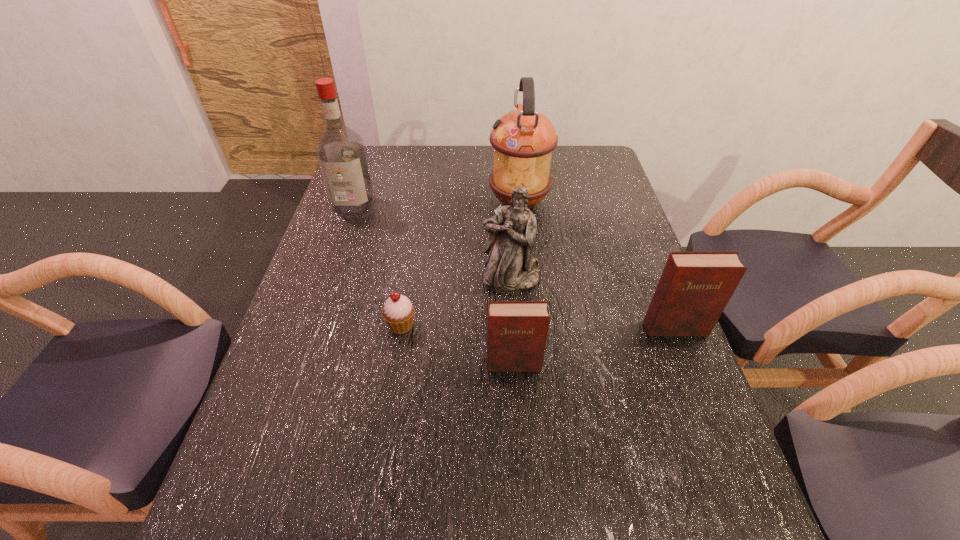
In order to click on free space between the shorter diary and the right diary in this screenshot , I will do `click(594, 346)`.

Where is `vacant point located between the liquor and the fifth object from right to left`? vacant point located between the liquor and the fifth object from right to left is located at coordinates (377, 265).

Identify which object is located as the fourth nearest to the left diary. Please provide its 2D coordinates. Your answer should be formatted as a tuple, i.e. [(x, y)], where the tuple contains the x and y coordinates of a point satisfying the conditions above.

[(523, 140)]

Choose which object is the fifth nearest neighbor to the left diary. Please provide its 2D coordinates. Your answer should be formatted as a tuple, i.e. [(x, y)], where the tuple contains the x and y coordinates of a point satisfying the conditions above.

[(340, 151)]

Where is `vacant area in the image that satisfies the following two spatial constraints: 1. on the front-facing side of the fifth object from right to left; 2. on the right side of the liquor`? The image size is (960, 540). vacant area in the image that satisfies the following two spatial constraints: 1. on the front-facing side of the fifth object from right to left; 2. on the right side of the liquor is located at coordinates (312, 325).

You are a GUI agent. You are given a task and a screenshot of the screen. Output one action in this format:
    pyautogui.click(x=<x>, y=<y>)
    Task: Click on the blank space that satisfies the following two spatial constraints: 1. on the front-facing side of the fifth object from right to left; 2. on the right side of the liquor
    
    Given the screenshot: What is the action you would take?
    pyautogui.click(x=312, y=325)